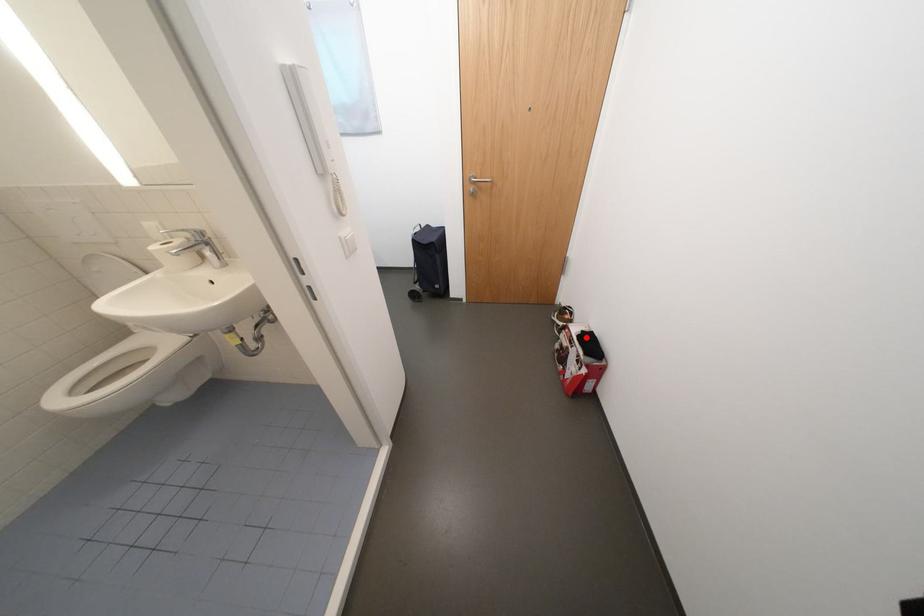
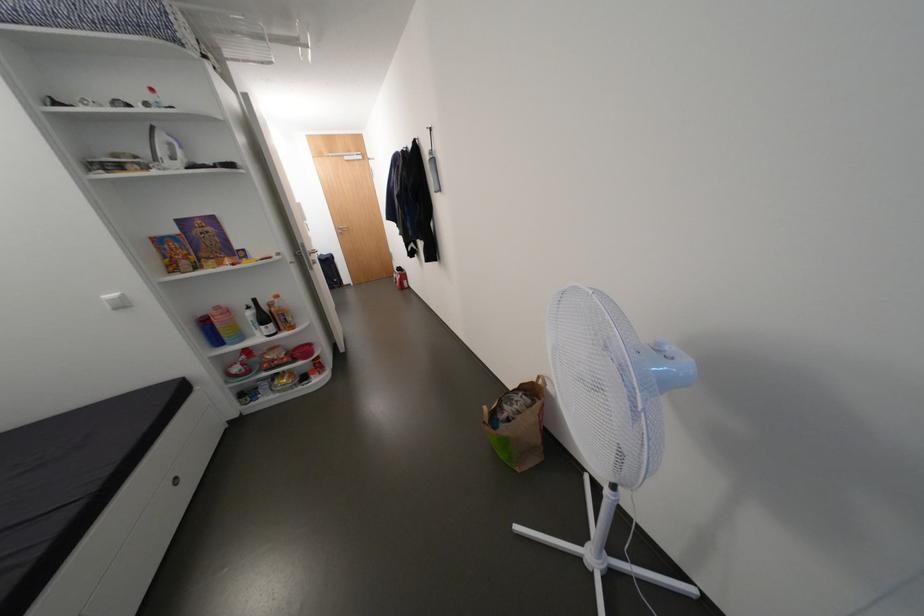
Locate, in the second image, the point that corresponds to the highlighted location in the first image.

(405, 270)